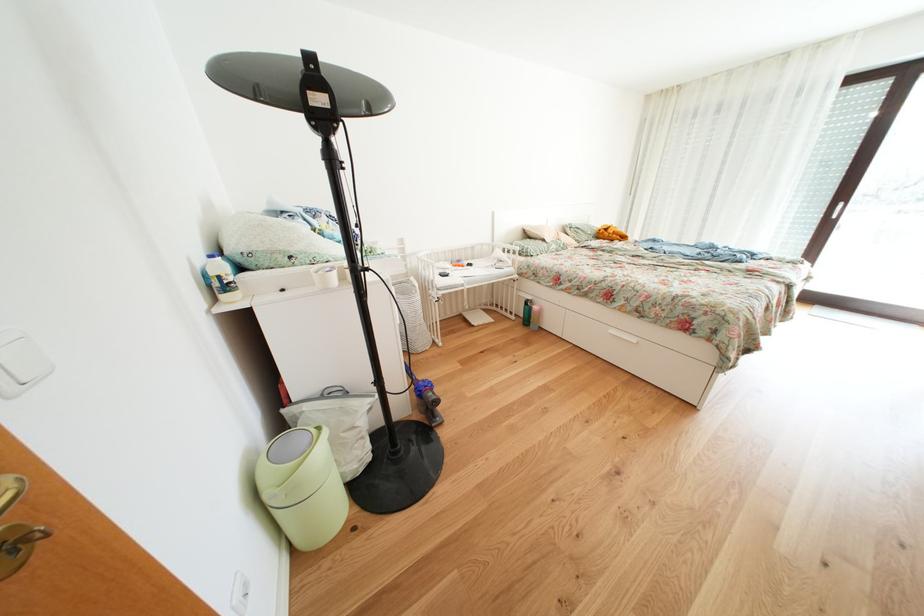
Where is `brass door handle`? This screenshot has width=924, height=616. brass door handle is located at coordinates (128, 467).